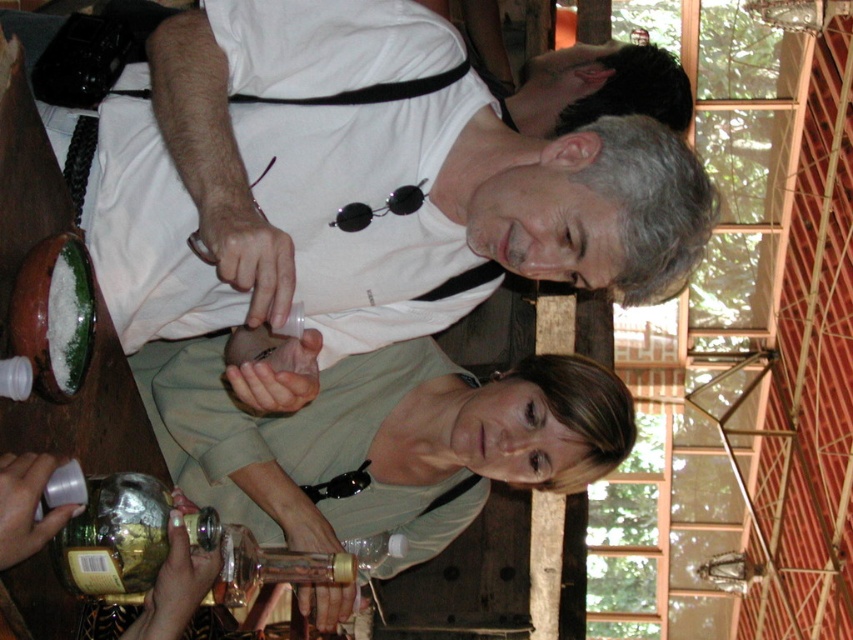
Which is in front, point (326, 385) or point (149, 506)?

Point (149, 506)

Can you confirm if green matte shirt at center is positioned below shiny metallic bottle at lower left?

Answer: Yes.

Describe the element at coordinates (381, 440) in the screenshot. I see `green matte shirt at center` at that location.

Find the location of a particular element. green matte shirt at center is located at coordinates (381, 440).

Is white matte shirt at upper center behind shiny metallic bottle at lower left?

A: Yes, it is behind shiny metallic bottle at lower left.

Can you confirm if white matte shirt at upper center is shorter than shiny metallic bottle at lower left?

No, white matte shirt at upper center is not shorter than shiny metallic bottle at lower left.

The height and width of the screenshot is (640, 853). What do you see at coordinates (248, 209) in the screenshot?
I see `white matte shirt at upper center` at bounding box center [248, 209].

Identify the location of white matte shirt at upper center. The width and height of the screenshot is (853, 640). (248, 209).

Is point (184, 92) closer to viewer compared to point (543, 458)?

Yes, it is in front of point (543, 458).

From the picture: Does white matte shirt at upper center have a greater width compared to green matte shirt at center?

No.

Between point (389, 273) and point (280, 433), which one is positioned in front?

Point (389, 273)

What are the coordinates of `white matte shirt at upper center` in the screenshot? It's located at (248, 209).